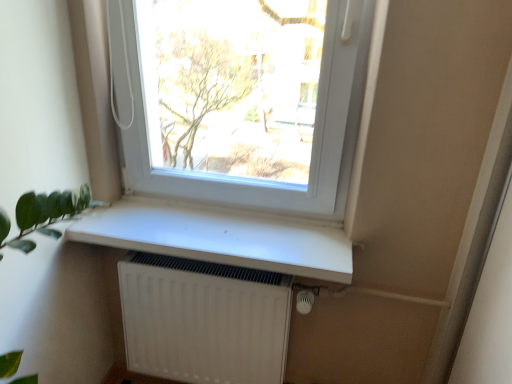
You are a GUI agent. You are given a task and a screenshot of the screen. Output one action in this format:
    pyautogui.click(x=<x>, y=<y>)
    Task: Click on the white matte window sill at center
    This screenshot has width=512, height=384.
    Given the screenshot: What is the action you would take?
    pyautogui.click(x=220, y=236)

Find the location of a particular element. The image size is (512, 384). white matte window sill at center is located at coordinates (220, 236).

Can you confirm if white matte window sill at center is thinner than white matte radiator at lower center?

Incorrect, the width of white matte window sill at center is not less than that of white matte radiator at lower center.

Is point (337, 250) farther from viewer compared to point (287, 333)?

That is False.

Considering the positions of objects white matte window sill at center and white matte radiator at lower center in the image provided, who is more to the left, white matte window sill at center or white matte radiator at lower center?

Positioned to the left is white matte radiator at lower center.

How many degrees apart are the facing directions of white matte window sill at center and white matte radiator at lower center?

The angle between the facing direction of white matte window sill at center and the facing direction of white matte radiator at lower center is 0.246 degrees.

Which is closer to the camera, (351, 98) or (145, 355)?

Clearly, point (351, 98) is closer to the camera than point (145, 355).

Identify the location of radiator below the white plastic window at upper center (from a real-world perspective). (204, 320).

Can you confirm if white plastic window at upper center is positioned to the right of white matte radiator at lower center?

Indeed, white plastic window at upper center is positioned on the right side of white matte radiator at lower center.

Locate an element on the screen. The height and width of the screenshot is (384, 512). window above the white matte radiator at lower center (from a real-world perspective) is located at coordinates (240, 99).

Would you say white matte radiator at lower center is to the left or to the right of white plastic window at upper center in the picture?

From the image, it's evident that white matte radiator at lower center is to the left of white plastic window at upper center.

From the image's perspective, is white matte radiator at lower center above or below white plastic window at upper center?

white matte radiator at lower center is situated lower than white plastic window at upper center in the image.

Is white matte radiator at lower center looking in the opposite direction of white plastic window at upper center?

No, white matte radiator at lower center's orientation is not away from white plastic window at upper center.

Is point (124, 303) in front of point (137, 233)?

That is False.

This screenshot has height=384, width=512. Identify the location of radiator behind the white matte window sill at center. (204, 320).

In terms of height, does white matte radiator at lower center look taller or shorter compared to white matte window sill at center?

Clearly, white matte radiator at lower center is taller compared to white matte window sill at center.

From the image's perspective, which is above, white matte radiator at lower center or white matte window sill at center?

white matte window sill at center, from the image's perspective.

From a real-world perspective, who is located lower, white plastic window at upper center or white matte window sill at center?

From a 3D spatial view, white matte window sill at center is below.

In the scene shown: Is white matte window sill at center inside white plastic window at upper center?

No, white plastic window at upper center does not contain white matte window sill at center.

Considering the positions of points (202, 126) and (223, 240), is point (202, 126) closer to camera compared to point (223, 240)?

No.

What's the angular difference between white matte window sill at center and white plastic window at upper center's facing directions?

The angle between the facing direction of white matte window sill at center and the facing direction of white plastic window at upper center is 0.561 degrees.

Is white plastic window at upper center completely or partially inside white matte window sill at center?

No, white plastic window at upper center is located outside of white matte window sill at center.

From the image's perspective, which one is positioned lower, white matte window sill at center or white plastic window at upper center?

white matte window sill at center is shown below in the image.

Can you confirm if white matte window sill at center is thinner than white plastic window at upper center?

In fact, white matte window sill at center might be wider than white plastic window at upper center.

I want to click on window sill in front of the white matte radiator at lower center, so click(x=220, y=236).

At what (x,y) coordinates should I click in order to perform the action: click on radiator that is below the white plastic window at upper center (from the image's perspective). Please return your answer as a coordinate pair (x, y). The height and width of the screenshot is (384, 512). Looking at the image, I should click on pos(204,320).

Looking at the image, which one is located closer to white matte window sill at center, white matte radiator at lower center or white plastic window at upper center?

white matte radiator at lower center is closer to white matte window sill at center.

Looking at the image, which one is located further to white plastic window at upper center, white matte window sill at center or white matte radiator at lower center?

white matte radiator at lower center is positioned further to the anchor white plastic window at upper center.

From the image, which object appears to be nearer to white matte radiator at lower center, white matte window sill at center or white plastic window at upper center?

Among the two, white matte window sill at center is located nearer to white matte radiator at lower center.

Considering their positions, is white matte radiator at lower center positioned further to white plastic window at upper center than white matte window sill at center?

The object further to white plastic window at upper center is white matte radiator at lower center.

Considering their positions, is white plastic window at upper center positioned further to white matte window sill at center than white matte radiator at lower center?

white plastic window at upper center is positioned further to the anchor white matte window sill at center.

Looking at the image, which one is located closer to white matte radiator at lower center, white plastic window at upper center or white matte window sill at center?

The object closer to white matte radiator at lower center is white matte window sill at center.

Locate an element on the screen. The height and width of the screenshot is (384, 512). window sill between white plastic window at upper center and white matte radiator at lower center from top to bottom is located at coordinates (220, 236).